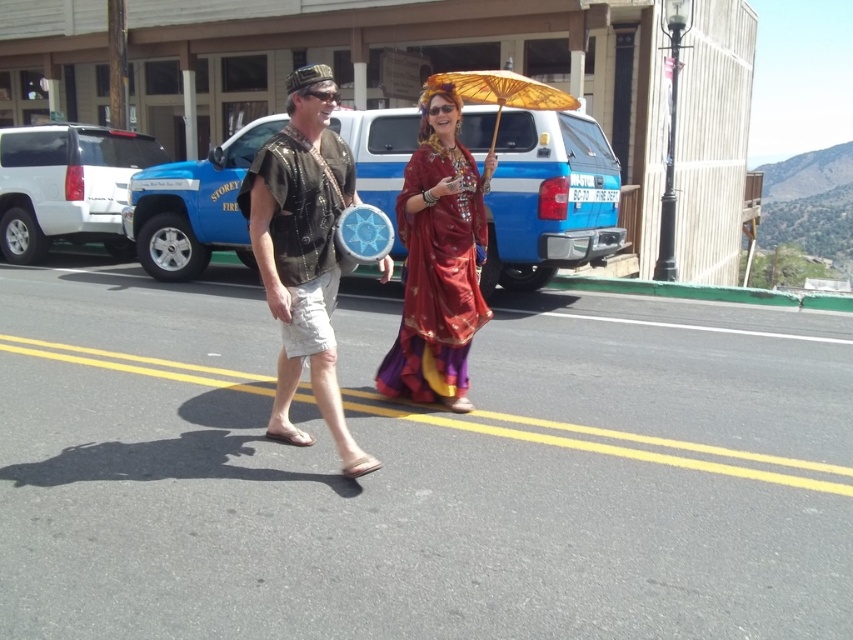
You are standing on the street and see two points marked in the image. Which point is closer to you, point (323, 410) or point (137, 160)?

Point (323, 410) is closer to the viewer than point (137, 160).

You are standing at the origin point of the image. You see a shiny red fabric dress at center represented by point (438, 260). If you move 0.2 units to the right, will you be closer to the shiny red fabric dress at center?

Moving 0.2 units to the right from the origin point would take you to the coordinate point 0.2, 0. The shiny red fabric dress at center is located at (438, 260). Since the dress is further to the right and up from the origin, moving only right by 0.2 units would not bring you closer to it. Therefore, you would not be closer.

You are a photographer trying to capture the perfect shot of the shiny red fabric dress at center and the wooden parasol at center. You want to ensure both are fully visible in the frame. Which object should you adjust your focus on to account for their sizes?

The shiny red fabric dress at center has a lesser width compared to wooden parasol at center, so you should focus on the wooden parasol at center to ensure it fits within the frame while still capturing the dress.